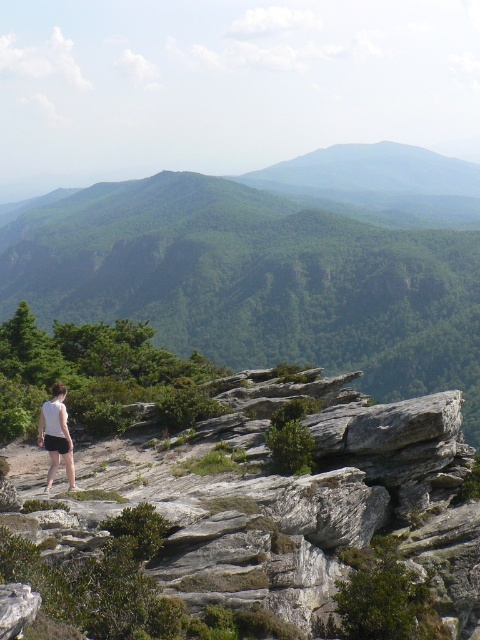
Question: Which object is positioned farthest from the white cotton shorts at lower left?

Choices:
 (A) green grassy mountain at upper center
 (B) white fabric shorts at lower left
 (C) gray rough rock at center
 (D) green leafy mountain at center

Answer: (A)

Question: Can you confirm if green grassy mountain at upper center is positioned to the left of white cotton shorts at lower left?

Choices:
 (A) no
 (B) yes

Answer: (A)

Question: Can you confirm if green leafy mountain at center is positioned above white fabric shorts at lower left?

Choices:
 (A) no
 (B) yes

Answer: (B)

Question: Is green leafy mountain at center wider than white cotton shorts at lower left?

Choices:
 (A) no
 (B) yes

Answer: (B)

Question: Which point is closer to the camera?

Choices:
 (A) white cotton shorts at lower left
 (B) green leafy mountain at center
 (C) gray rough rock at center
 (D) white fabric shorts at lower left

Answer: (C)

Question: Which of these objects is positioned farthest from the white fabric shorts at lower left?

Choices:
 (A) green leafy mountain at center
 (B) green grassy mountain at upper center
 (C) gray rough rock at center

Answer: (B)